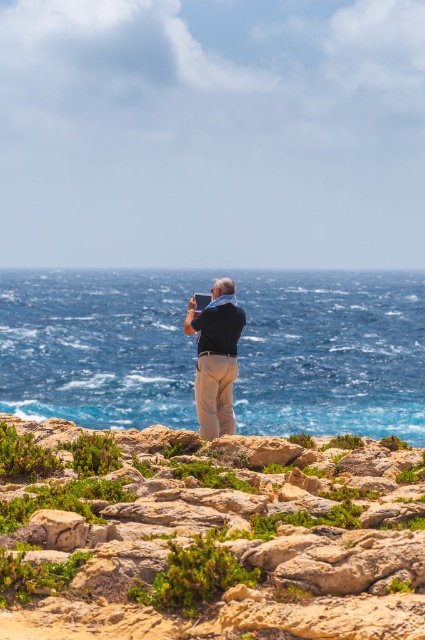
Does rugged stone shoreline at center have a larger size compared to blue water at center?

No.

Between point (223, 596) and point (33, 320), which one is positioned in front?

Positioned in front is point (223, 596).

The image size is (425, 640). In order to click on rugged stone shoreline at center in this screenshot , I will do `click(204, 538)`.

At what (x,y) coordinates should I click in order to perform the action: click on blue water at center. Please return your answer as a coordinate pair (x, y). Looking at the image, I should click on (331, 353).

Is blue water at center closer to the viewer compared to matte black shirt at center?

That is False.

Which is in front, point (362, 337) or point (238, 317)?

Point (238, 317)

Image resolution: width=425 pixels, height=640 pixels. What are the coordinates of `blue water at center` in the screenshot? It's located at (331, 353).

From the picture: Is rugged stone shoreline at center below matte black shirt at center?

Yes.

Who is more distant from viewer, (159, 560) or (223, 337)?

Positioned behind is point (223, 337).

Does point (190, 467) lie behind point (226, 429)?

That is False.

Where is `rugged stone shoreline at center`? Image resolution: width=425 pixels, height=640 pixels. rugged stone shoreline at center is located at coordinates (204, 538).